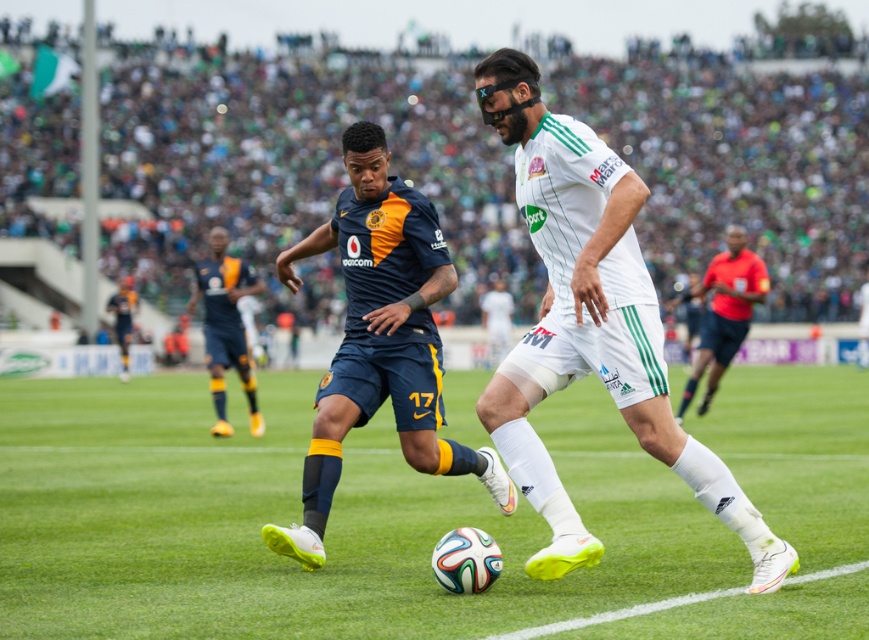
Who is positioned more to the left, dark blue jersey at center or red shirt at right?

dark blue jersey at center

Is point (233, 280) less distant than point (727, 326)?

That is True.

The width and height of the screenshot is (869, 640). Identify the location of dark blue jersey at center. (224, 324).

Who is higher up, white matte soccer player at center or dark blue jersey at center?

Positioned higher is dark blue jersey at center.

Does white matte soccer player at center have a smaller size compared to dark blue jersey at center?

Indeed, white matte soccer player at center has a smaller size compared to dark blue jersey at center.

Does point (531, 493) come in front of point (204, 260)?

That is True.

What are the coordinates of `white matte soccer player at center` in the screenshot? It's located at (591, 324).

Consider the image. Does white matte soccer player at center lie behind matte blue shorts at center?

No, white matte soccer player at center is in front of matte blue shorts at center.

Which is behind, point (569, 276) or point (388, 209)?

Positioned behind is point (388, 209).

What are the coordinates of `white matte soccer player at center` in the screenshot? It's located at (591, 324).

Where is `white matte soccer player at center`? The width and height of the screenshot is (869, 640). white matte soccer player at center is located at coordinates (591, 324).